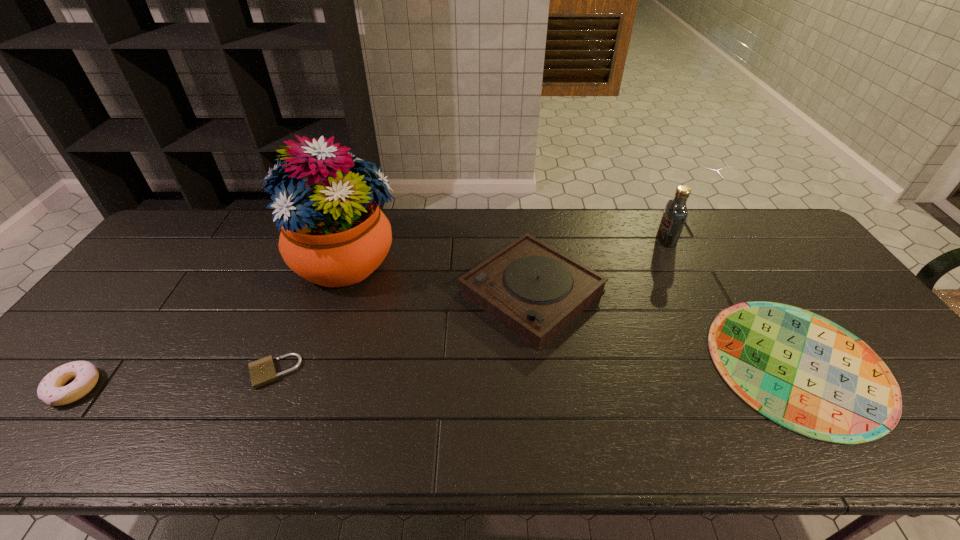
Image resolution: width=960 pixels, height=540 pixels. What are the coordinates of `vacant space that satisfies the following two spatial constraints: 1. on the back side of the gameboard; 2. on the front-facing side of the fifth shortest object` in the screenshot? It's located at (720, 240).